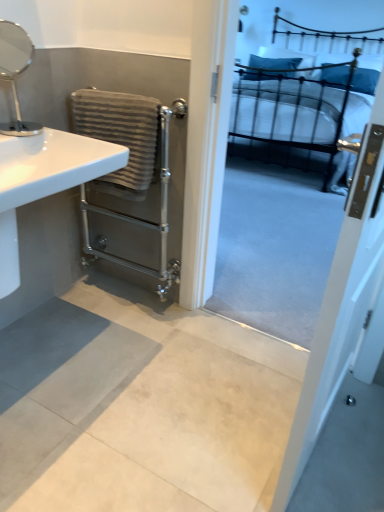
Question: Is white glossy sink at left facing towards silver metallic mirror at upper left?

Choices:
 (A) yes
 (B) no

Answer: (B)

Question: Is white glossy sink at left bigger than silver metallic mirror at upper left?

Choices:
 (A) no
 (B) yes

Answer: (B)

Question: Considering the relative positions of white glossy sink at left and silver metallic mirror at upper left in the image provided, is white glossy sink at left in front of silver metallic mirror at upper left?

Choices:
 (A) yes
 (B) no

Answer: (A)

Question: From the image's perspective, is white glossy sink at left above silver metallic mirror at upper left?

Choices:
 (A) yes
 (B) no

Answer: (B)

Question: Can you confirm if white glossy sink at left is positioned to the right of silver metallic mirror at upper left?

Choices:
 (A) no
 (B) yes

Answer: (B)

Question: Does white glossy sink at left have a smaller size compared to silver metallic mirror at upper left?

Choices:
 (A) yes
 (B) no

Answer: (B)

Question: Does white glossy sink at left have a lesser width compared to gray textured towel at left?

Choices:
 (A) yes
 (B) no

Answer: (B)

Question: Is white glossy sink at left far away from gray textured towel at left?

Choices:
 (A) no
 (B) yes

Answer: (A)

Question: From a real-world perspective, is white glossy sink at left on top of gray textured towel at left?

Choices:
 (A) no
 (B) yes

Answer: (B)

Question: Can you confirm if white glossy sink at left is shorter than gray textured towel at left?

Choices:
 (A) yes
 (B) no

Answer: (A)

Question: Is white glossy sink at left not within gray textured towel at left?

Choices:
 (A) yes
 (B) no

Answer: (A)

Question: Considering the relative positions of white glossy sink at left and gray textured towel at left in the image provided, is white glossy sink at left to the left of gray textured towel at left from the viewer's perspective?

Choices:
 (A) yes
 (B) no

Answer: (A)

Question: From the image's perspective, is white glossy sink at left under metallic black bed at upper right?

Choices:
 (A) yes
 (B) no

Answer: (A)